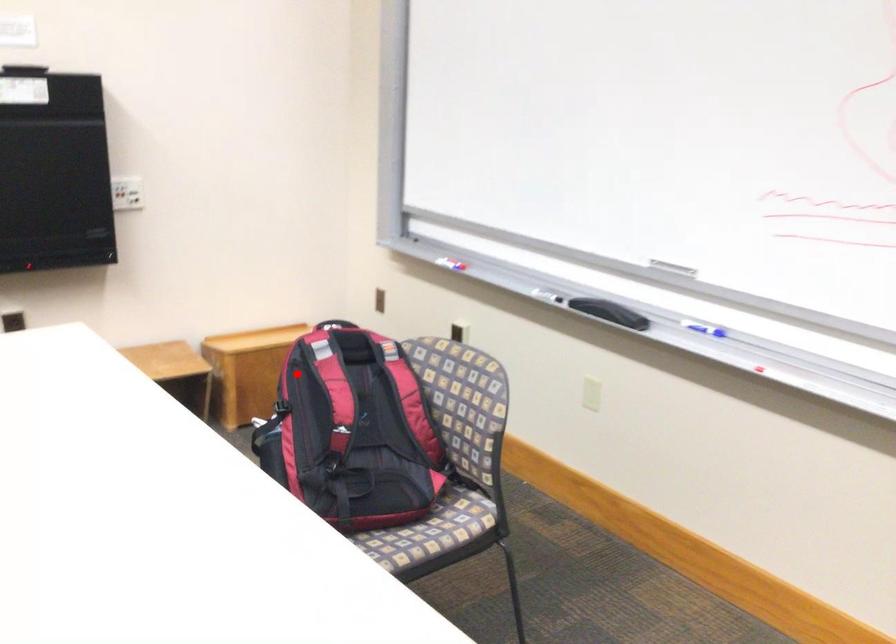
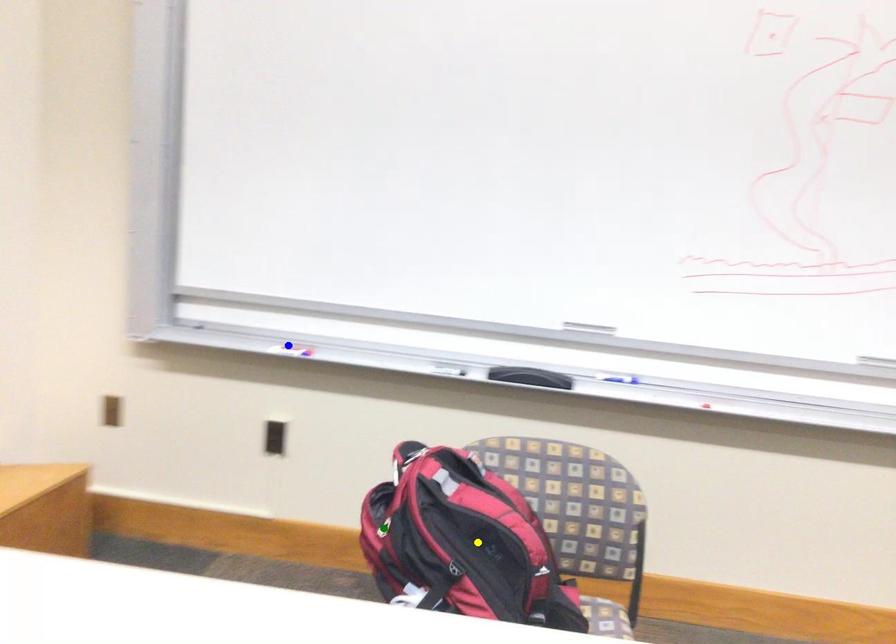
Question: I am providing you with two images of the same scene from different viewpoints. A red point is marked on the first image. You are given multiple points on the second image. In image 2, which mark is for the same physical point as the one in image 1?

Choices:
 (A) green point
 (B) yellow point
 (C) blue point

Answer: (A)